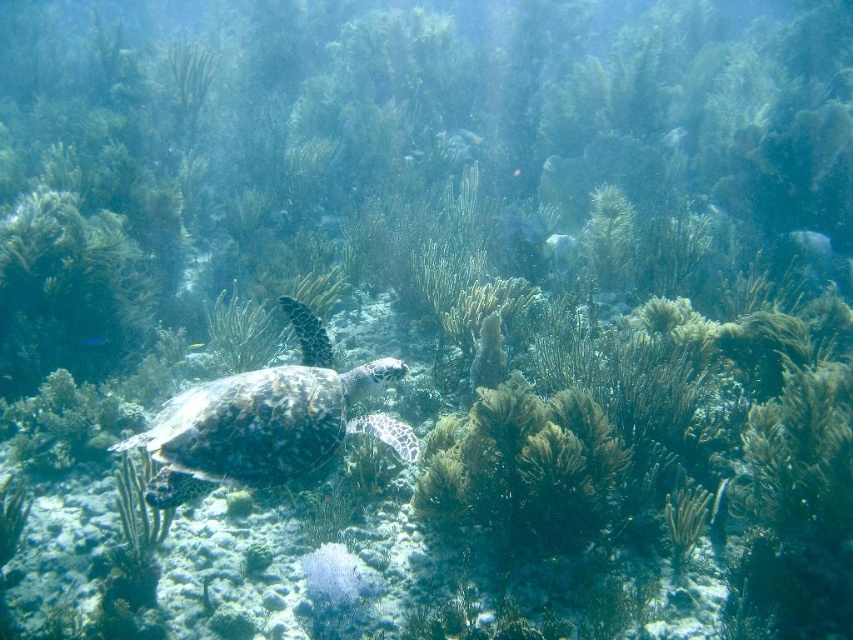
You are a marine biologist observing the underwater scene. You notice the shiny silver fish at upper center and the translucent white fish at center. Which fish is positioned higher in the water column?

The shiny silver fish at upper center is positioned higher in the water column than the translucent white fish at center.